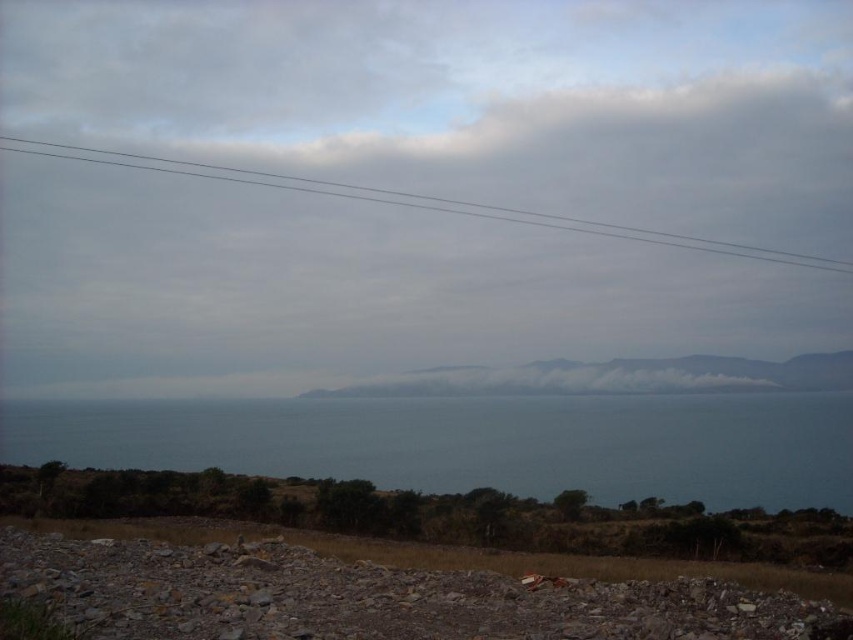
Question: Does blue water at center have a smaller size compared to gray wire at upper center?

Choices:
 (A) yes
 (B) no

Answer: (A)

Question: Among these points, which one is nearest to the camera?

Choices:
 (A) (448, 212)
 (B) (573, 584)

Answer: (B)

Question: Which point is farther to the camera?

Choices:
 (A) (769, 458)
 (B) (810, 260)
 (C) (27, 531)

Answer: (B)

Question: Does blue water at center appear under gray wire at upper center?

Choices:
 (A) no
 (B) yes

Answer: (B)

Question: Is gray gravel pile at lower center positioned behind gray wire at upper center?

Choices:
 (A) no
 (B) yes

Answer: (A)

Question: Which point appears closest to the camera in this image?

Choices:
 (A) (798, 404)
 (B) (390, 202)

Answer: (A)